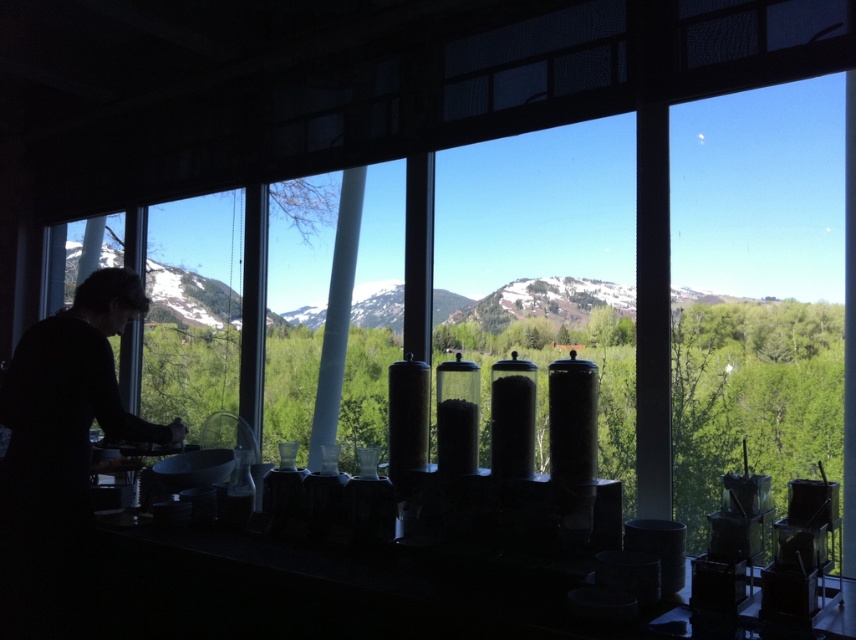
How distant is transparent glass containers at center from transparent glass window at center?

transparent glass containers at center and transparent glass window at center are 21.36 inches apart from each other.

In the scene shown: Is transparent glass containers at center further to camera compared to transparent glass window at center?

No.

This screenshot has height=640, width=856. I want to click on transparent glass containers at center, so click(x=536, y=237).

In the scene shown: Between transparent glass containers at center and snowy mountain at center, which one appears on the left side from the viewer's perspective?

Positioned to the left is snowy mountain at center.

Is transparent glass containers at center below snowy mountain at center?

Result: Correct, transparent glass containers at center is located below snowy mountain at center.

What do you see at coordinates (536, 237) in the screenshot? The height and width of the screenshot is (640, 856). I see `transparent glass containers at center` at bounding box center [536, 237].

Where is `transparent glass containers at center`? This screenshot has width=856, height=640. transparent glass containers at center is located at coordinates (536, 237).

Which is in front, point (331, 182) or point (173, 246)?

Point (331, 182) is more forward.

Who is taller, transparent glass window at center or transparent glass window at left?

transparent glass window at center

Between point (325, 300) and point (201, 337), which one is positioned behind?

The point (201, 337) is more distant.

This screenshot has height=640, width=856. I want to click on transparent glass window at center, so click(x=330, y=296).